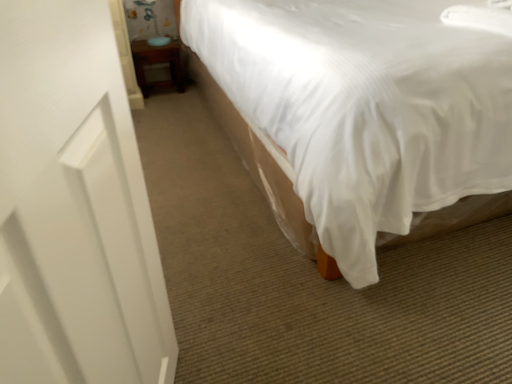
Image resolution: width=512 pixels, height=384 pixels. Describe the element at coordinates (157, 64) in the screenshot. I see `wooden table at lower left` at that location.

The image size is (512, 384). What do you see at coordinates (367, 112) in the screenshot?
I see `white fabric bed at center` at bounding box center [367, 112].

In order to click on white matte screen door at left in this screenshot , I will do `click(74, 208)`.

You are a GUI agent. You are given a task and a screenshot of the screen. Output one action in this format:
    pyautogui.click(x=<x>, y=<y>)
    Task: Click on the wooden table at lower left
    The image size is (512, 384).
    Given the screenshot: What is the action you would take?
    [157, 64]

Based on the photo, is white matte screen door at left taller than wooden table at lower left?

Yes.

Could wooden table at lower left be considered to be inside white matte screen door at left?

No, wooden table at lower left is located outside of white matte screen door at left.

Is point (73, 322) in front of point (135, 62)?

Yes.

What are the coordinates of `screen door above the wooden table at lower left (from a real-world perspective)` in the screenshot? It's located at (74, 208).

Is white fabric bed at center at the back of white matte screen door at left?

No, white matte screen door at left's orientation is not away from white fabric bed at center.

From the image's perspective, is white matte screen door at left above or below white fabric bed at center?

From the image's perspective, white matte screen door at left appears below white fabric bed at center.

The width and height of the screenshot is (512, 384). There is a white fabric bed at center. Identify the location of screen door above it (from a real-world perspective). (74, 208).

Is white matte screen door at left positioned far away from white fabric bed at center?

No, white matte screen door at left is not far away from white fabric bed at center.

Does point (172, 58) come closer to viewer compared to point (35, 143)?

No, (172, 58) is further to viewer.

From the image's perspective, which one is positioned lower, wooden table at lower left or white matte screen door at left?

white matte screen door at left appears lower in the image.

Considering the relative positions of wooden table at lower left and white matte screen door at left in the image provided, is wooden table at lower left to the left or to the right of white matte screen door at left?

From the image, it's evident that wooden table at lower left is to the left of white matte screen door at left.

Consider the image. Is white fabric bed at center facing towards wooden table at lower left?

No, white fabric bed at center is not facing towards wooden table at lower left.

From the image's perspective, which one is positioned lower, white fabric bed at center or wooden table at lower left?

white fabric bed at center appears lower in the image.

Is white fabric bed at center not near wooden table at lower left?

Yes.

From a real-world perspective, is white fabric bed at center on top of wooden table at lower left?

Indeed, from a real-world perspective, white fabric bed at center stands above wooden table at lower left.

Which point is more forward, (x=410, y=144) or (x=96, y=164)?

Positioned in front is point (x=96, y=164).

Considering the positions of objects white fabric bed at center and white matte screen door at left in the image provided, who is more to the left, white fabric bed at center or white matte screen door at left?

Positioned to the left is white matte screen door at left.

Is white fabric bed at center aimed at white matte screen door at left?

No, white fabric bed at center is not oriented towards white matte screen door at left.

Can we say wooden table at lower left lies outside white fabric bed at center?

Yes.

From the image's perspective, is wooden table at lower left located above or below white fabric bed at center?

wooden table at lower left is situated higher than white fabric bed at center in the image.

From a real-world perspective, is wooden table at lower left on white fabric bed at center?

Incorrect, from a real-world perspective, wooden table at lower left is lower than white fabric bed at center.

Looking at this image, is wooden table at lower left positioned in front of white fabric bed at center?

No, it is behind white fabric bed at center.

The image size is (512, 384). I want to click on screen door that appears on the right of wooden table at lower left, so click(74, 208).

Where is `bed behind the white matte screen door at left`? Image resolution: width=512 pixels, height=384 pixels. bed behind the white matte screen door at left is located at coordinates (367, 112).

When comparing their distances from white fabric bed at center, does wooden table at lower left or white matte screen door at left seem closer?

white matte screen door at left is closer to white fabric bed at center.

Considering their positions, is white fabric bed at center positioned closer to white matte screen door at left than wooden table at lower left?

The object closer to white matte screen door at left is white fabric bed at center.

Looking at this image, looking at the image, which one is located closer to white fabric bed at center, white matte screen door at left or wooden table at lower left?

white matte screen door at left is closer to white fabric bed at center.

Looking at the image, which one is located further to white matte screen door at left, wooden table at lower left or white fabric bed at center?

wooden table at lower left is positioned further to the anchor white matte screen door at left.

Estimate the real-world distances between objects in this image. Which object is further from wooden table at lower left, white fabric bed at center or white matte screen door at left?

Based on the image, white matte screen door at left appears to be further to wooden table at lower left.

Based on their spatial positions, is white matte screen door at left or white fabric bed at center closer to wooden table at lower left?

white fabric bed at center.

This screenshot has height=384, width=512. Identify the location of bed between white matte screen door at left and wooden table at lower left from front to back. (367, 112).